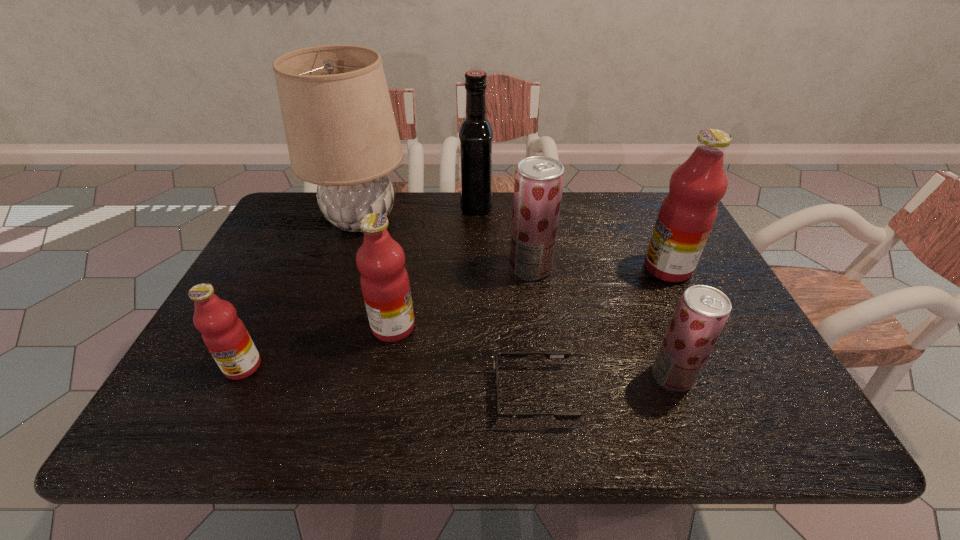
The height and width of the screenshot is (540, 960). I want to click on vacant area situated on the back of the nearer strawberry fruit juice, so click(633, 274).

Locate an element on the screen. vacant area situated on the label of the smallest pink fruit juice is located at coordinates (219, 416).

Image resolution: width=960 pixels, height=540 pixels. In order to click on free region located on the temples of the shortest object in this screenshot , I will do `click(464, 394)`.

Image resolution: width=960 pixels, height=540 pixels. Identify the location of vacant space located on the temples of the shortest object. (468, 394).

In order to click on blank space located 0.140m on the temples of the shortest object in this screenshot , I will do `click(424, 394)`.

This screenshot has width=960, height=540. Identify the location of lampshade that is at the far edge. (341, 133).

Find the location of `liquor that is positioned at the far edge`. liquor that is positioned at the far edge is located at coordinates (476, 132).

Locate an element on the screen. This screenshot has height=540, width=960. object situated at the near edge is located at coordinates (549, 355).

The width and height of the screenshot is (960, 540). I want to click on lampshade at the left edge, so click(341, 133).

Where is `fruit juice situated at the left edge`? This screenshot has width=960, height=540. fruit juice situated at the left edge is located at coordinates (224, 334).